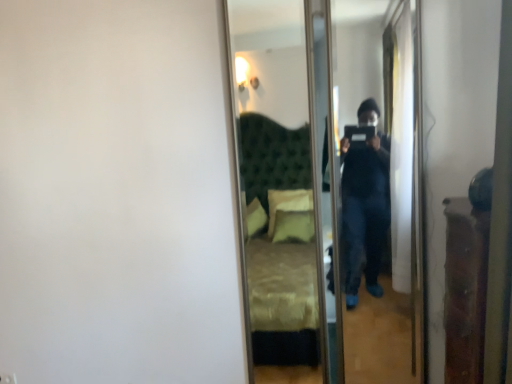
Locate an element on the screen. The height and width of the screenshot is (384, 512). clear glass mirror at center is located at coordinates (322, 186).

The width and height of the screenshot is (512, 384). Describe the element at coordinates (322, 186) in the screenshot. I see `clear glass mirror at center` at that location.

Locate an element on the screen. The image size is (512, 384). clear glass mirror at center is located at coordinates (322, 186).